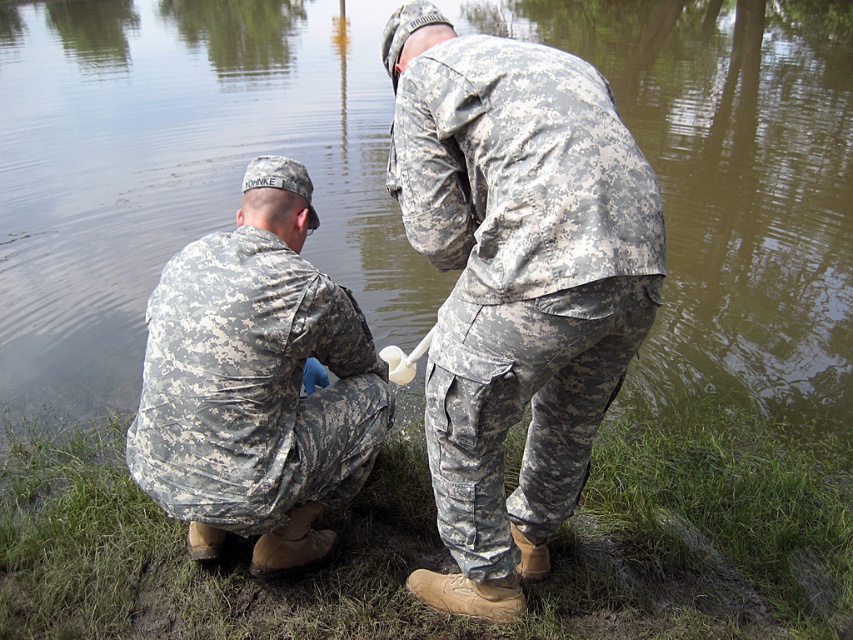
Based on the scene description, where is the camouflage fabric pants at lower center located in terms of its 2D coordinates?

The camouflage fabric pants at lower center is located at the 2D coordinates of point (515, 282).

You are a photographer trying to capture a photo of both the camouflage fabric pants at lower center and the camouflage fabric uniform at left. Based on their heights, which one should you focus on first to ensure they are both in frame?

The camouflage fabric pants at lower center is taller than the camouflage fabric uniform at left, so you should focus on the camouflage fabric pants at lower center first to ensure both are in frame.